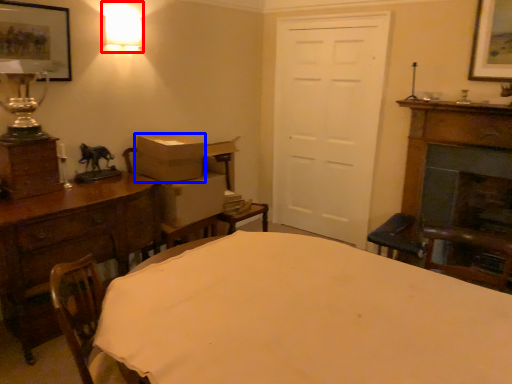
Question: Which of the following is the closest to the observer, lamp (highlighted by a red box) or cardboard box (highlighted by a blue box)?

Choices:
 (A) lamp
 (B) cardboard box

Answer: (A)